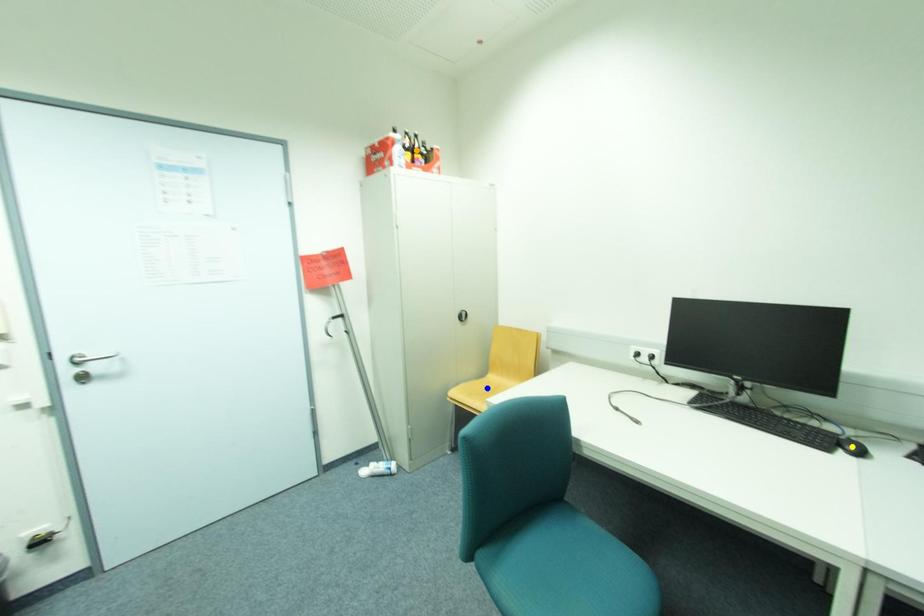
Order these from nearest to farthest:
- yellow point
- orange point
- blue point

yellow point
orange point
blue point